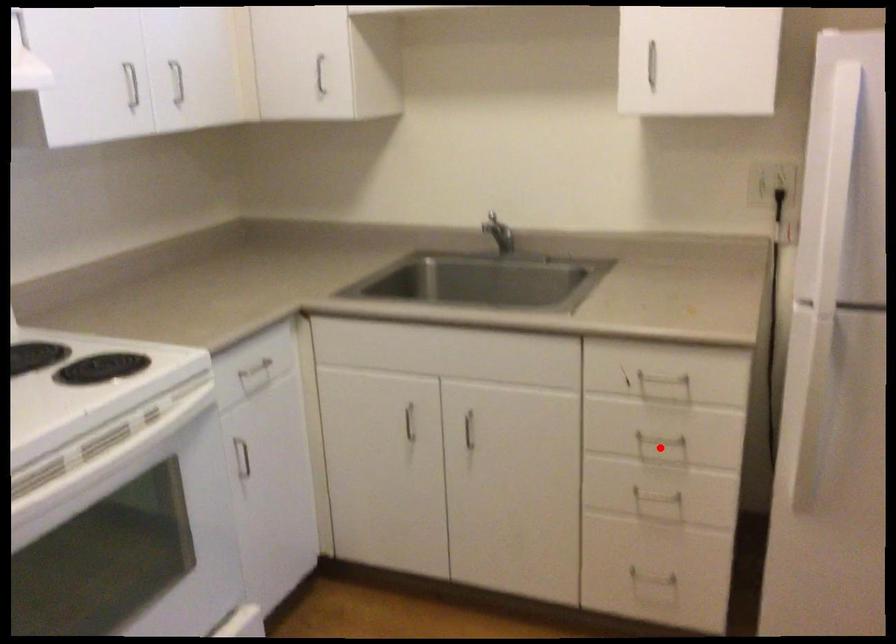
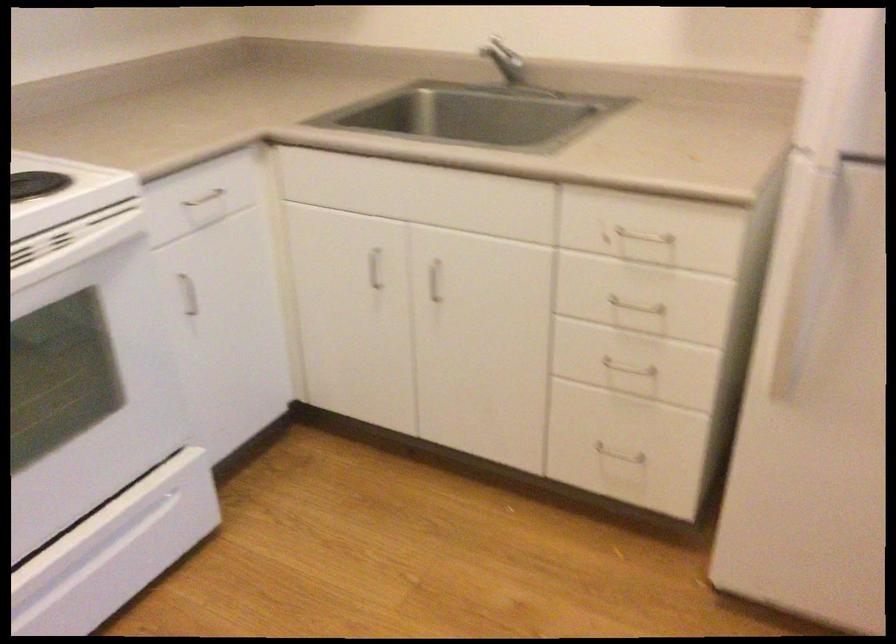
In the second image, find the point that corresponds to the highlighted location in the first image.

(634, 313)